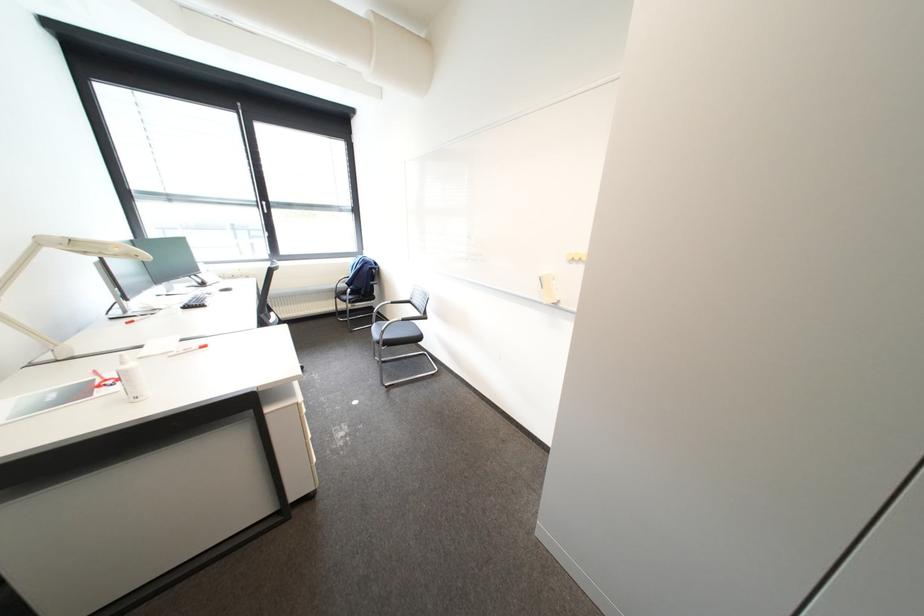
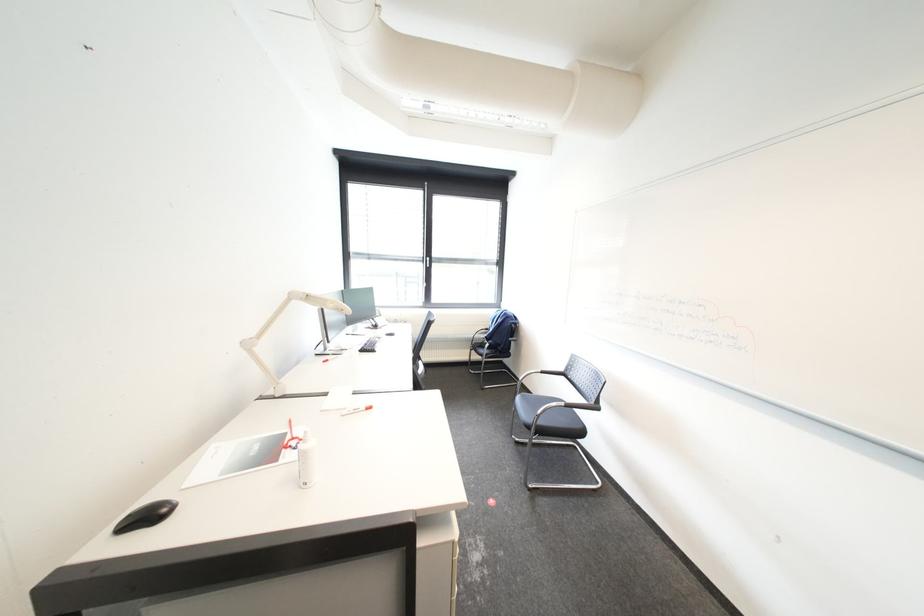
Question: Based on the continuous images, in which direction is the camera rotating? Reply with the corresponding letter.

Choices:
 (A) Left
 (B) Right
 (C) Up
 (D) Down

Answer: (A)